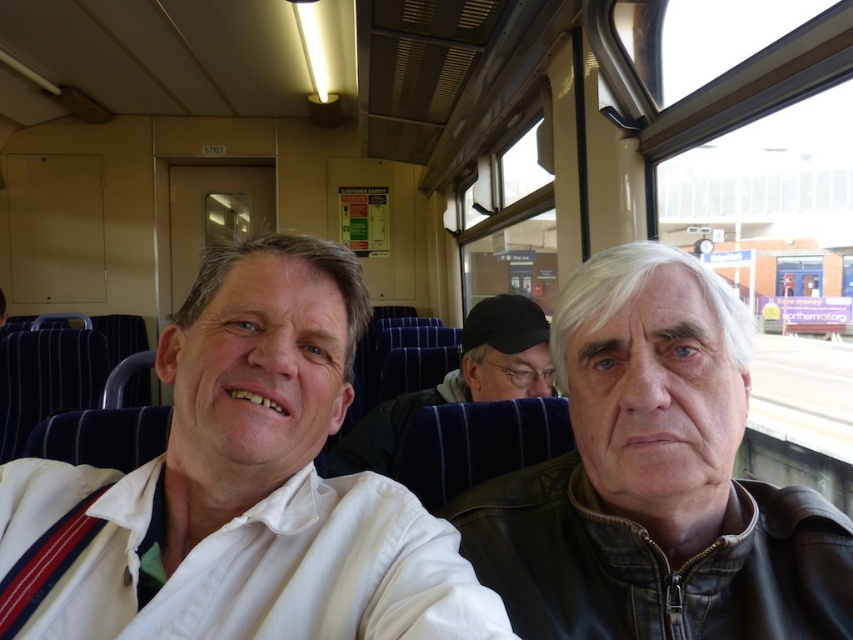
In the scene shown: Is white shirt at center taller than dark blue fabric jacket at center?

Incorrect, white shirt at center's height is not larger of dark blue fabric jacket at center's.

Is point (318, 552) positioned before point (483, 323)?

Yes, it is.

Which is behind, point (335, 618) or point (537, 326)?

The point (537, 326) is more distant.

You are a GUI agent. You are given a task and a screenshot of the screen. Output one action in this format:
    pyautogui.click(x=<x>, y=<y>)
    Task: Click on the white shirt at center
    This screenshot has height=640, width=853.
    Given the screenshot: What is the action you would take?
    pyautogui.click(x=241, y=486)

Who is shorter, leather jacket at right or dark blue fabric jacket at center?

Standing shorter between the two is leather jacket at right.

Can you confirm if leather jacket at right is shorter than dark blue fabric jacket at center?

Indeed, leather jacket at right has a lesser height compared to dark blue fabric jacket at center.

Is point (621, 576) farther from viewer compared to point (546, 378)?

No, it is not.

Locate an element on the screen. leather jacket at right is located at coordinates (654, 480).

Between white shirt at center and leather jacket at right, which one appears on the left side from the viewer's perspective?

Positioned to the left is white shirt at center.

Does white shirt at center have a smaller size compared to leather jacket at right?

No, white shirt at center is not smaller than leather jacket at right.

Between point (77, 589) and point (683, 316), which one is positioned behind?

The point (77, 589) is more distant.

Where is `white shirt at center`? The width and height of the screenshot is (853, 640). white shirt at center is located at coordinates (241, 486).